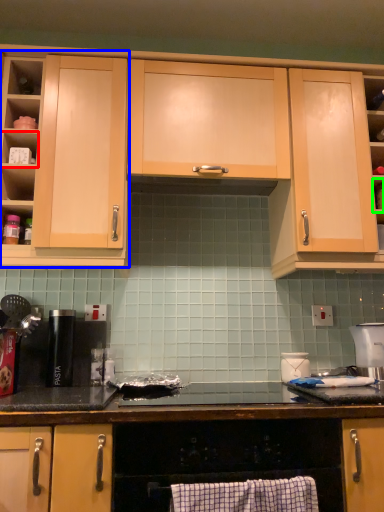
Question: Which is farther away from shelf (highlighted by a red box)? cabinetry (highlighted by a blue box) or shelf (highlighted by a green box)?

Choices:
 (A) cabinetry
 (B) shelf

Answer: (B)